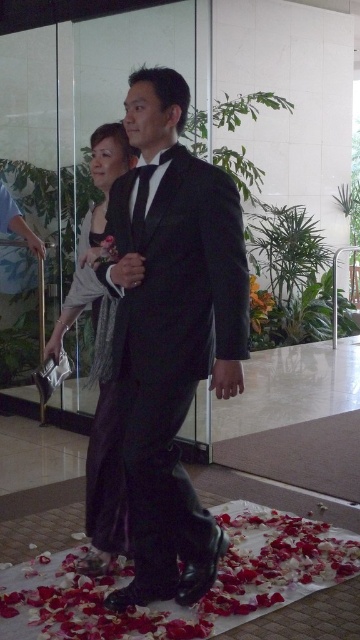
You are a photographer capturing the couple walking on the petal path. You need to ensure both the satin black dress at center and the orange matte flower at center are in focus. Which object should you focus on first to capture both in the same frame?

The satin black dress at center is positioned on the left side of orange matte flower at center, so you should focus on the satin black dress at center first to ensure both are in focus.

In the scene shown: You are a photographer positioned at the center of the scene. You want to capture a closeup of the satin black dress at center. Which direction should you move to get closer to the dress?

The satin black dress at center is located at point 0.559 on the x axis and 0.278 on the y axis. Since you are at the center of the scene, which is point 0.5 on both axes, you should move slightly to the right along the x axis and slightly forward along the y axis to reach the dress.